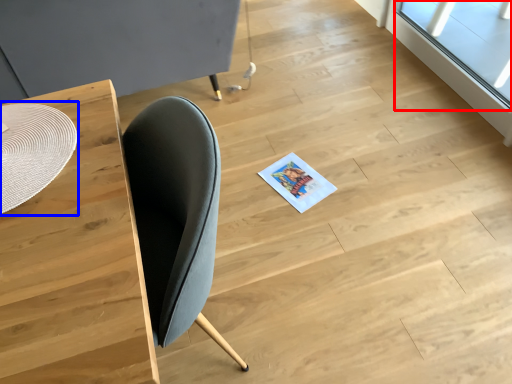
Question: Which object is further to the camera taking this photo, window (highlighted by a red box) or round table (highlighted by a blue box)?

Choices:
 (A) window
 (B) round table

Answer: (A)